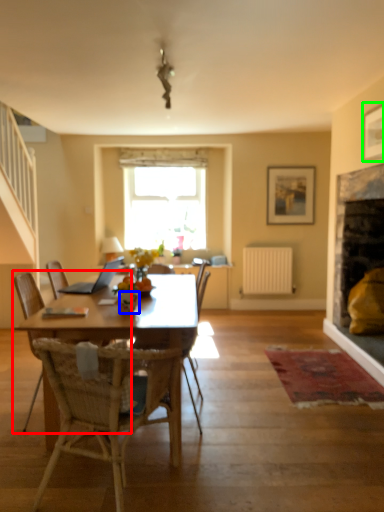
Question: Which object is the closest to the chair (highlighted by a red box)? Choose among these: vase (highlighted by a blue box) or picture frame (highlighted by a green box).

Choices:
 (A) vase
 (B) picture frame

Answer: (A)